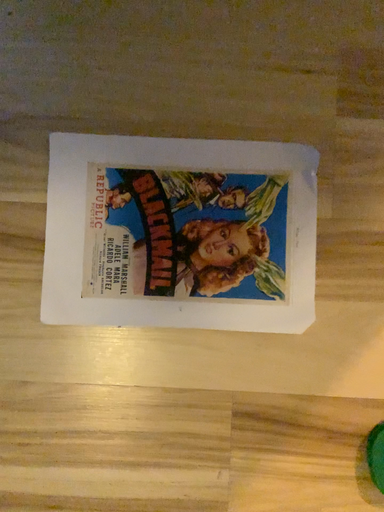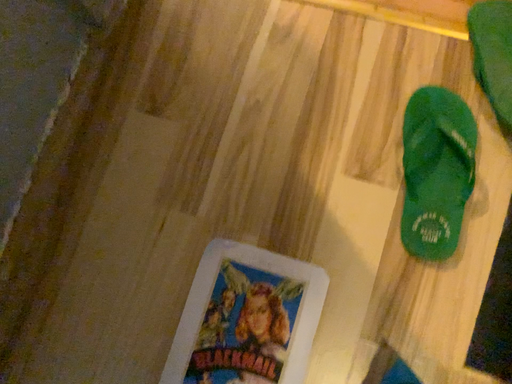
Question: How did the camera likely rotate when shooting the video?

Choices:
 (A) rotated upward
 (B) rotated downward

Answer: (A)